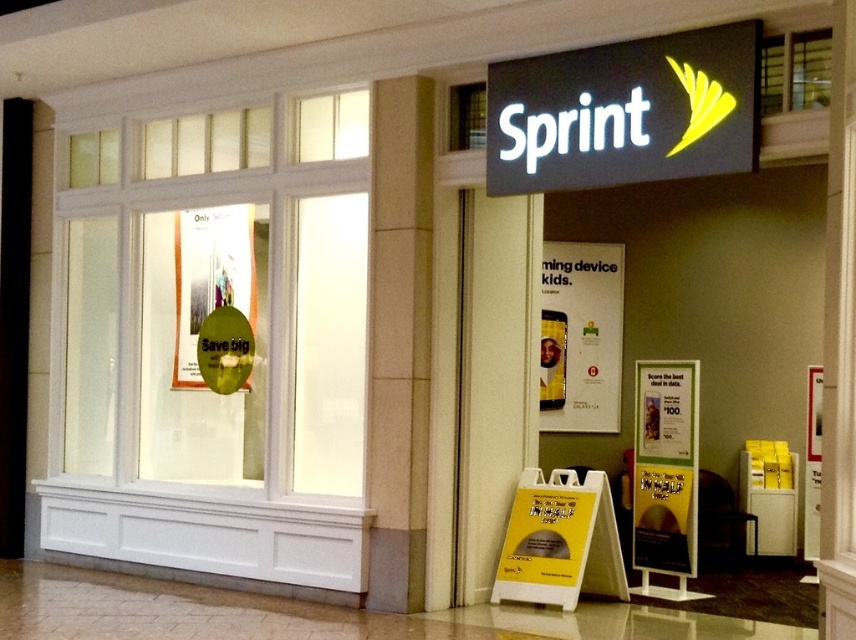
You are a customer entering the Sprint store and want to read both the yellow paper sign at center and the green glossy sign at upper left. Which sign should you look at first to read them in the correct order from top to bottom?

You should look at the green glossy sign at upper left first because it is positioned above the yellow paper sign at center.

What is the color of the sign located at point (625,112)?

The sign at point (625,112) is black matte.

You are a delivery person who needs to place a package between the white paper sign at center and the green glossy sign at upper left. The package is 5 meters long. Can you fit the package between them without bending it?

The distance between the white paper sign at center and the green glossy sign at upper left is 4.97 meters. Since the package is 5 meters long, it cannot fit between them without bending it.